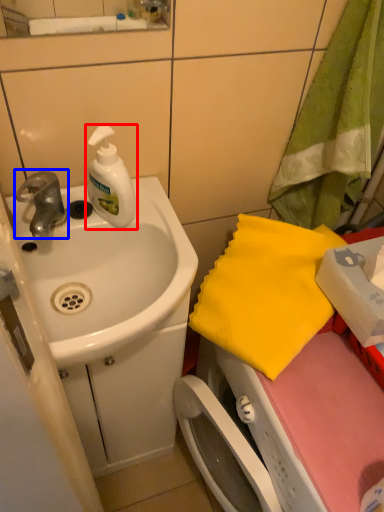
Question: Which point is further to the camera, soap dispenser (highlighted by a red box) or tap (highlighted by a blue box)?

Choices:
 (A) soap dispenser
 (B) tap

Answer: (B)